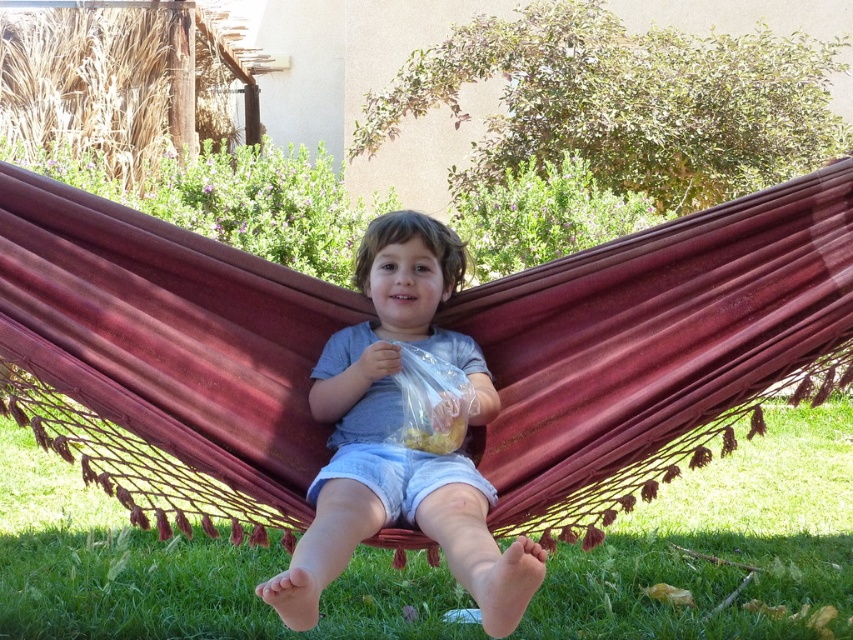
Which of these two, burgundy fabric hammock at center or matte gray shirt at center, stands shorter?

matte gray shirt at center is shorter.

Find the location of a particular element. The height and width of the screenshot is (640, 853). burgundy fabric hammock at center is located at coordinates (654, 349).

Where is `burgundy fabric hammock at center`? Image resolution: width=853 pixels, height=640 pixels. burgundy fabric hammock at center is located at coordinates (654, 349).